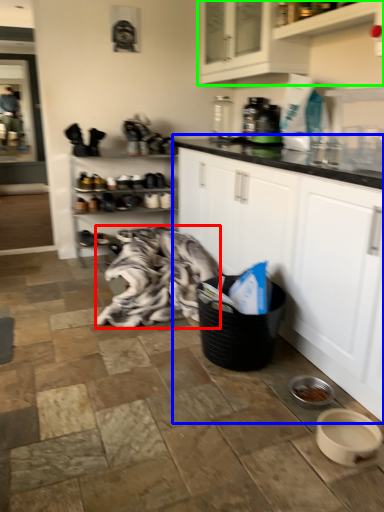
Question: Considering the real-world distances, which object is farthest from blanket (highlighted by a red box)? cabinetry (highlighted by a blue box) or cabinetry (highlighted by a green box)?

Choices:
 (A) cabinetry
 (B) cabinetry

Answer: (B)